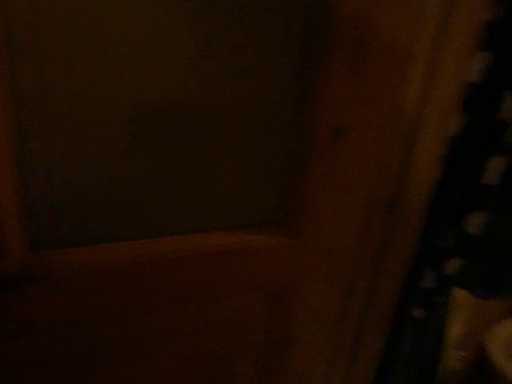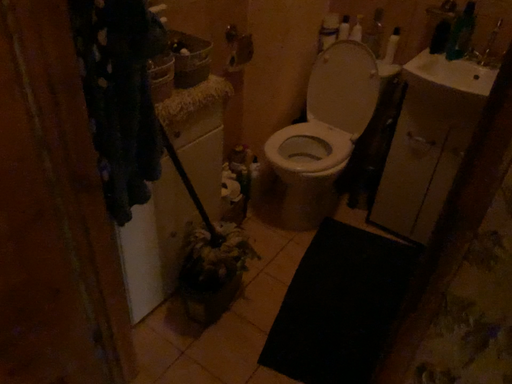
Question: Which way did the camera rotate in the video?

Choices:
 (A) rotated right
 (B) rotated left

Answer: (A)